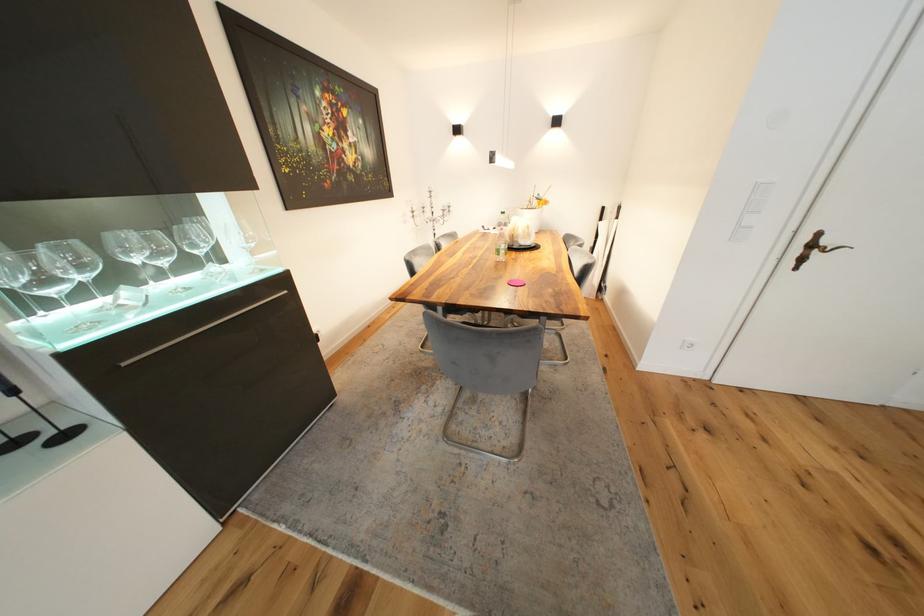
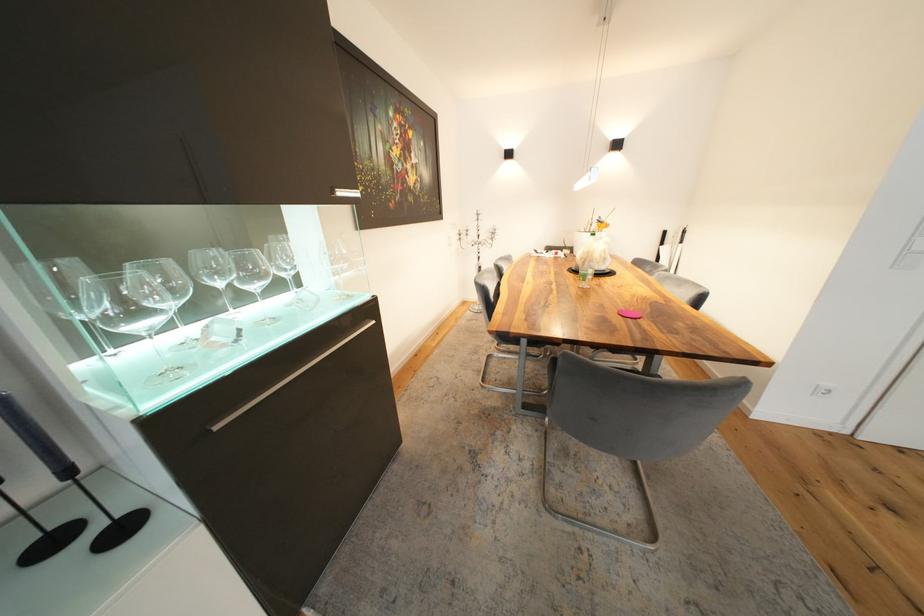
Where in the second image is the point corresponding to pixel 419 214 from the first image?

(467, 236)